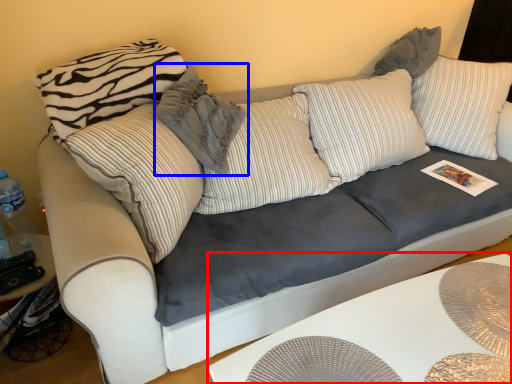
Question: Among these objects, which one is nearest to the camera, table (highlighted by a red box) or pillow (highlighted by a blue box)?

Choices:
 (A) table
 (B) pillow

Answer: (A)